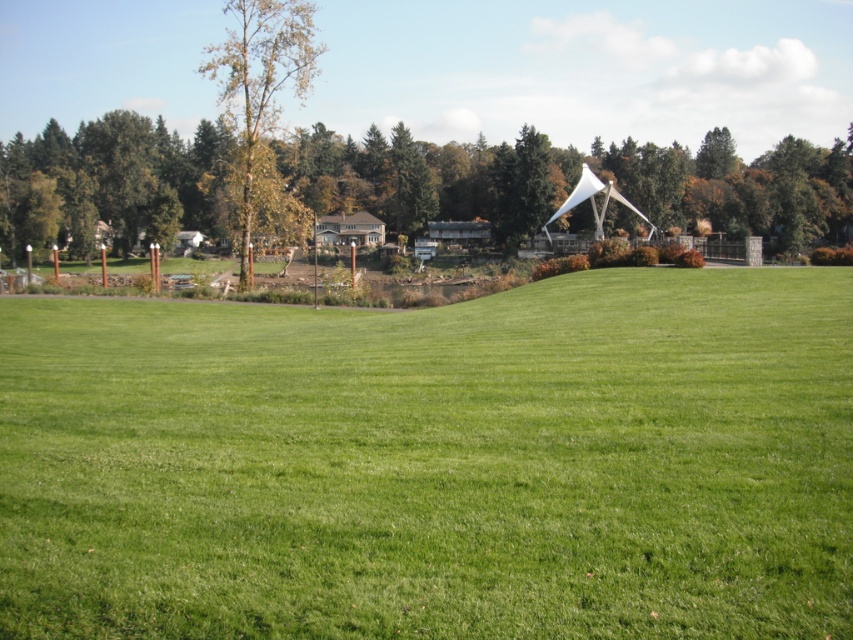
Question: Can you confirm if brown wood tree at upper center is smaller than green leafy tree at upper left?

Choices:
 (A) no
 (B) yes

Answer: (B)

Question: Is green leafy tree at upper left further to the viewer compared to green matte tree at upper center?

Choices:
 (A) yes
 (B) no

Answer: (B)

Question: Among these points, which one is farthest from the camera?

Choices:
 (A) (521, 164)
 (B) (230, 129)

Answer: (A)

Question: Which point is closer to the camera taking this photo?

Choices:
 (A) (403, 216)
 (B) (532, 566)
 (C) (251, 124)

Answer: (B)

Question: Which object appears closest to the camera in this image?

Choices:
 (A) green matte tree at upper center
 (B) green leafy tree at upper left

Answer: (B)

Question: Does green grass at center have a smaller size compared to green leafy tree at upper left?

Choices:
 (A) no
 (B) yes

Answer: (B)